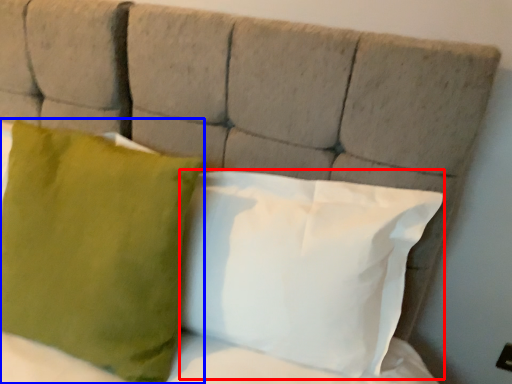
Question: Which point is closer to the camera, pillow (highlighted by a red box) or pillow (highlighted by a blue box)?

Choices:
 (A) pillow
 (B) pillow

Answer: (B)